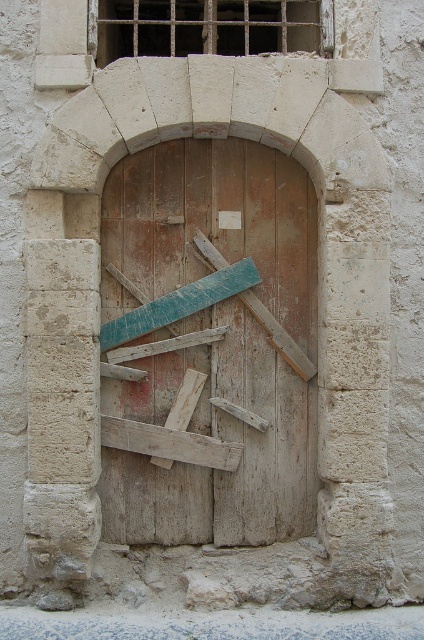
You are a carpenter assessing the door and its reinforcement. Given that the teal wood plank at center is 2 feet wide, can you determine if the weathered wood door at center is wide enough to allow a 3 feet wide wooden crate to pass through?

The weathered wood door at center is wider than the teal wood plank at center, which is 2 feet wide. Therefore, the door is at least 2 feet wide, but since the crate requires 3 feet, the door might not be wide enough. However, without knowing the exact width of the door, we cannot confirm for certain.

You are standing in front of the stone archway and want to reach the teal wood plank at center. Which direction should you move relative to the weathered wood door at center?

The weathered wood door at center is to the right of the teal wood plank at center, so you should move to the left relative to the weathered wood door at center to reach the teal wood plank at center.